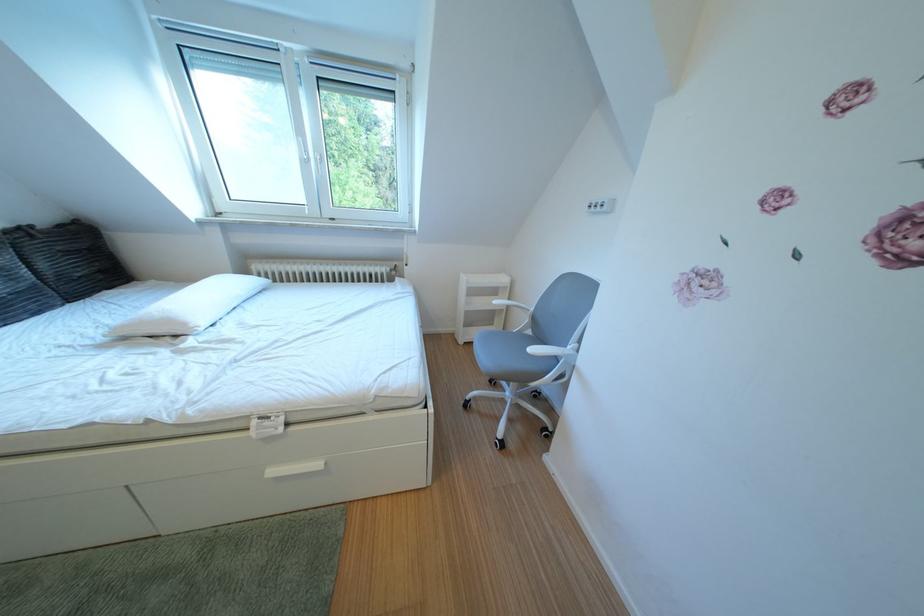
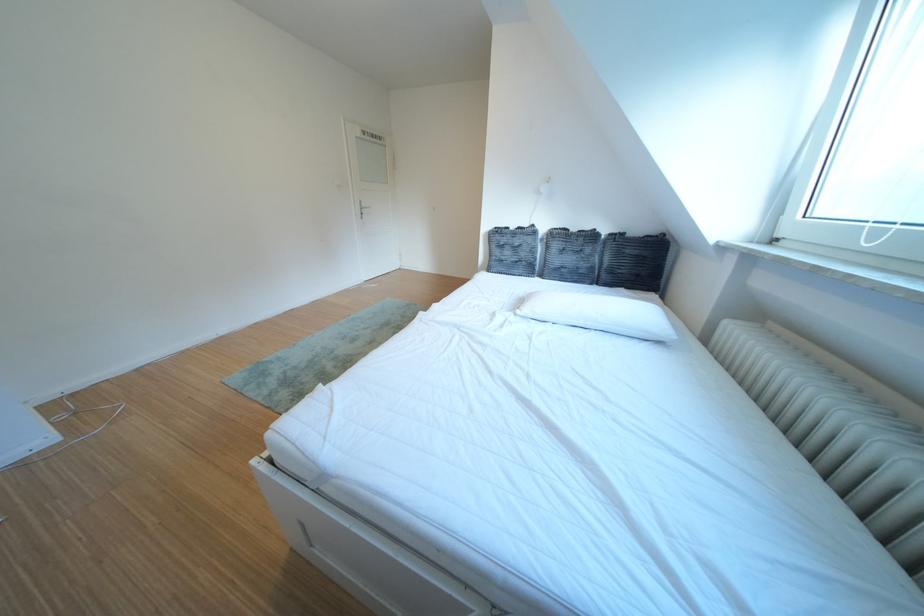
The point at [214,326] is marked in the first image. Where is the corresponding point in the second image?

(540, 314)